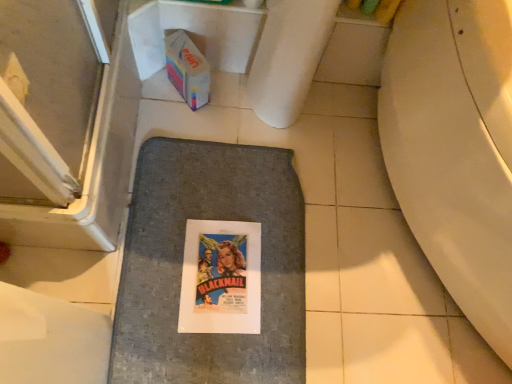
This screenshot has width=512, height=384. Identify the location of free space on the front side of multicolored cardboard box at upper left. (175, 137).